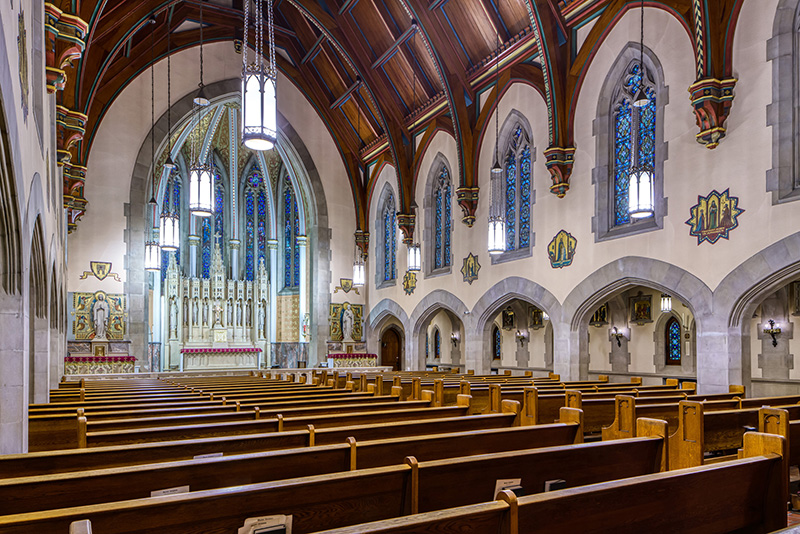
The height and width of the screenshot is (534, 800). Find the location of `hymn books`. hymn books is located at coordinates (554, 480), (516, 489), (278, 525).